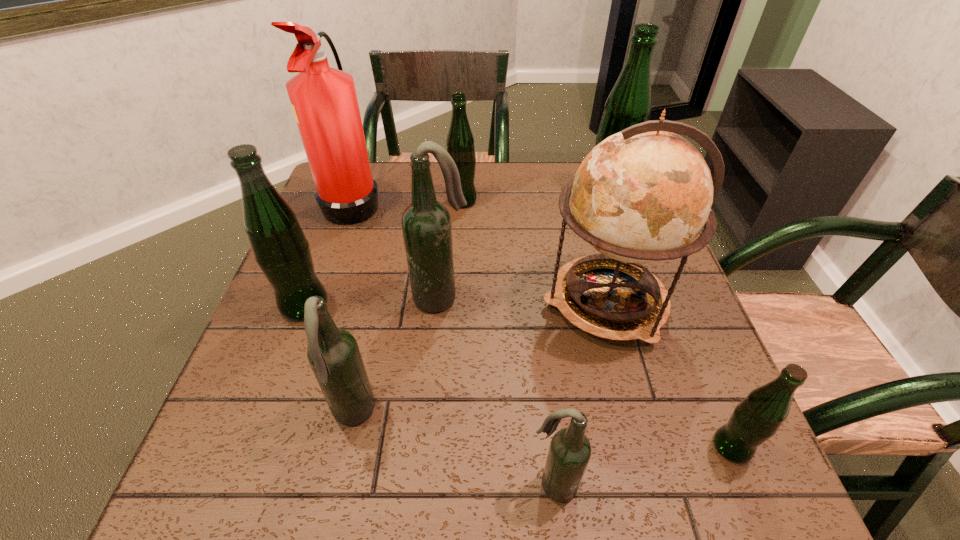
What are the coordinates of `the smallest green beer bottle` in the screenshot? It's located at (757, 417).

Where is `the nearest beer bottle`? the nearest beer bottle is located at coordinates (569, 453).

At what (x,y) coordinates should I click in order to perform the action: click on the rightmost dark beer bottle. Please return your answer as a coordinate pair (x, y). Looking at the image, I should click on (569, 453).

Locate an element on the screen. This screenshot has width=960, height=540. free space located at the spray nozzle of the red fire extinguisher is located at coordinates (x=500, y=201).

Find the location of a particular element. vacant position located 0.240m on the front of the biggest green beer bottle is located at coordinates (632, 278).

Where is `free space located at the center of the globe`? free space located at the center of the globe is located at coordinates (451, 303).

You are a GUI agent. You are given a task and a screenshot of the screen. Output one action in this format:
    pyautogui.click(x=<x>, y=<y>)
    Task: Click on the free spot located at the center of the globe
    The width and height of the screenshot is (960, 540).
    Given the screenshot: What is the action you would take?
    pyautogui.click(x=370, y=303)

Where is `vacant space located 0.370m at the center of the globe`? Image resolution: width=960 pixels, height=540 pixels. vacant space located 0.370m at the center of the globe is located at coordinates (373, 303).

Find the location of a particular element. This screenshot has width=960, height=540. free region located on the right of the farthest dark beer bottle is located at coordinates (612, 298).

The width and height of the screenshot is (960, 540). Find the location of `blank space located on the back of the leftmost beer bottle`. blank space located on the back of the leftmost beer bottle is located at coordinates (333, 227).